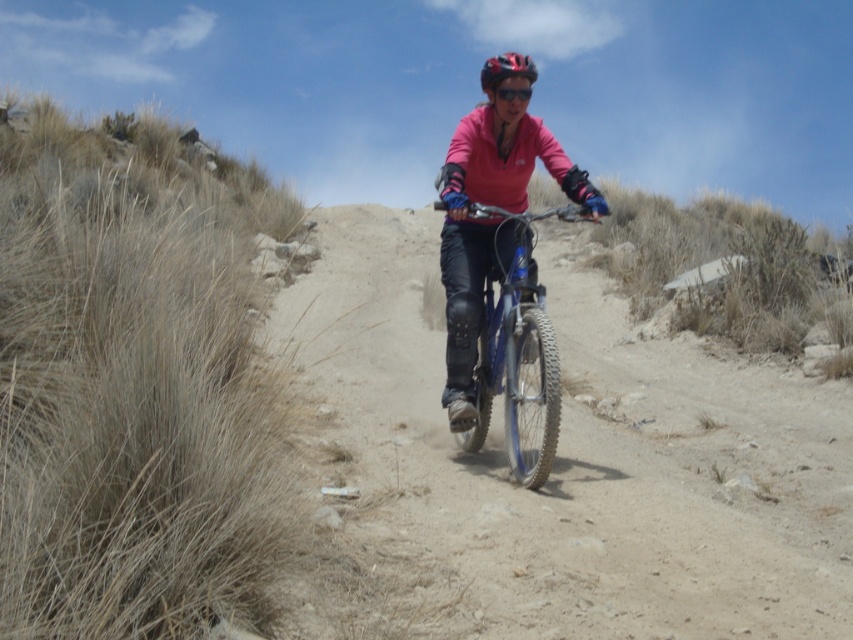
Can you confirm if blue metallic bicycle at center is taller than shiny red helmet at center?

Incorrect, blue metallic bicycle at center's height is not larger of shiny red helmet at center's.

Is blue metallic bicycle at center shorter than shiny red helmet at center?

Yes.

Image resolution: width=853 pixels, height=640 pixels. I want to click on blue metallic bicycle at center, so click(x=517, y=349).